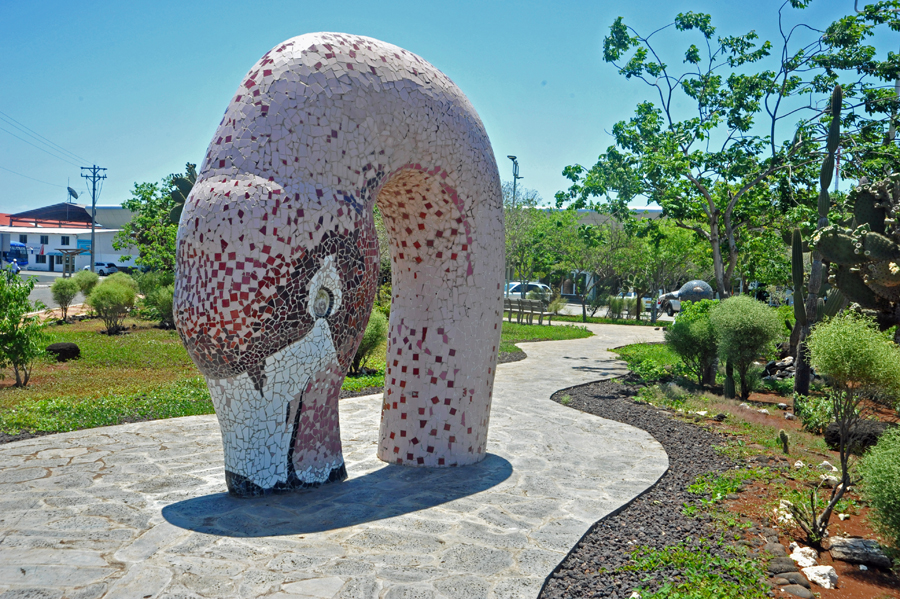
Where is `red tiles`? Image resolution: width=900 pixels, height=599 pixels. red tiles is located at coordinates (240, 264), (225, 270), (230, 314), (234, 326).